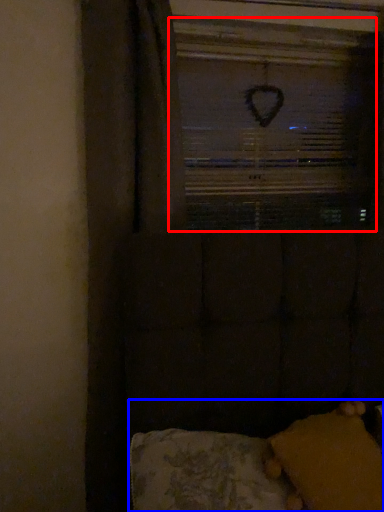
Question: Among these objects, which one is nearest to the camera, window screen (highlighted by a red box) or furniture (highlighted by a blue box)?

Choices:
 (A) window screen
 (B) furniture

Answer: (B)